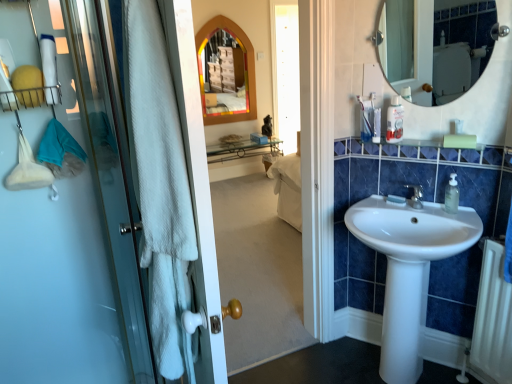
Question: Could you tell me if white textured towel at left is turned towards multicolored glass medicine cabinet at center?

Choices:
 (A) no
 (B) yes

Answer: (A)

Question: From the image's perspective, is white textured towel at left beneath multicolored glass medicine cabinet at center?

Choices:
 (A) no
 (B) yes

Answer: (B)

Question: Is white textured towel at left directly adjacent to multicolored glass medicine cabinet at center?

Choices:
 (A) no
 (B) yes

Answer: (A)

Question: From a real-world perspective, is white textured towel at left physically below multicolored glass medicine cabinet at center?

Choices:
 (A) no
 (B) yes

Answer: (B)

Question: Would you say white textured towel at left contains multicolored glass medicine cabinet at center?

Choices:
 (A) no
 (B) yes

Answer: (A)

Question: Can you confirm if white textured towel at left is smaller than multicolored glass medicine cabinet at center?

Choices:
 (A) yes
 (B) no

Answer: (B)

Question: From the image's perspective, is multicolored glass medicine cabinet at center on top of clear plastic bottle at upper right?

Choices:
 (A) yes
 (B) no

Answer: (A)

Question: From a real-world perspective, is multicolored glass medicine cabinet at center over clear plastic bottle at upper right?

Choices:
 (A) no
 (B) yes

Answer: (B)

Question: Considering the relative sizes of multicolored glass medicine cabinet at center and clear plastic bottle at upper right in the image provided, is multicolored glass medicine cabinet at center wider than clear plastic bottle at upper right?

Choices:
 (A) yes
 (B) no

Answer: (B)

Question: Is multicolored glass medicine cabinet at center next to clear plastic bottle at upper right and touching it?

Choices:
 (A) no
 (B) yes

Answer: (A)

Question: Could you tell me if multicolored glass medicine cabinet at center is turned towards clear plastic bottle at upper right?

Choices:
 (A) no
 (B) yes

Answer: (B)

Question: From a real-world perspective, is multicolored glass medicine cabinet at center located beneath clear plastic bottle at upper right?

Choices:
 (A) no
 (B) yes

Answer: (A)

Question: Can you confirm if white matte soap at sink right is wider than white glossy sink at center?

Choices:
 (A) no
 (B) yes

Answer: (A)